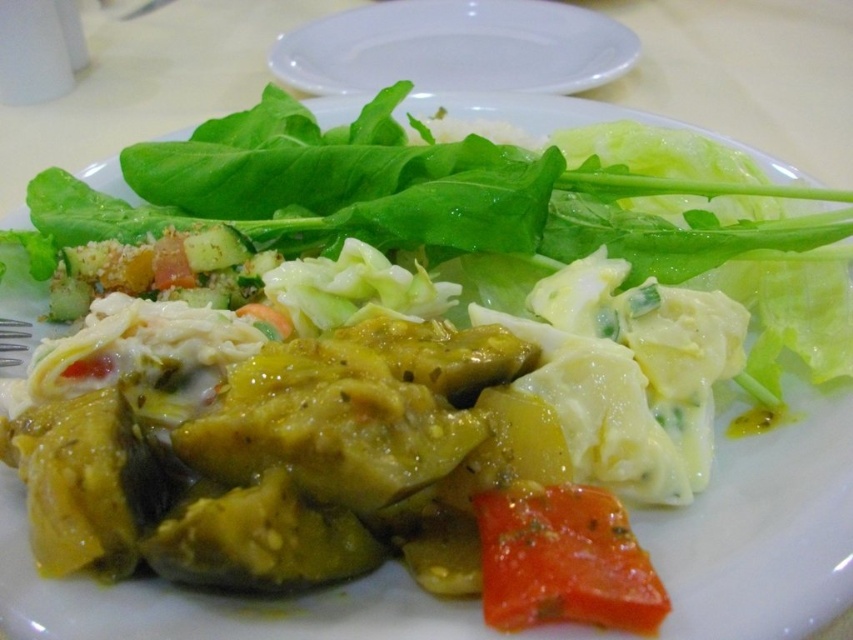
Between white plastic plate at upper center and glossy red tomato at lower center, which one is positioned lower?

glossy red tomato at lower center

Can you confirm if white plastic plate at upper center is positioned to the right of glossy red tomato at lower center?

Incorrect, white plastic plate at upper center is not on the right side of glossy red tomato at lower center.

You are a GUI agent. You are given a task and a screenshot of the screen. Output one action in this format:
    pyautogui.click(x=<x>, y=<y>)
    Task: Click on the white plastic plate at upper center
    Image resolution: width=853 pixels, height=640 pixels.
    Given the screenshot: What is the action you would take?
    pyautogui.click(x=456, y=49)